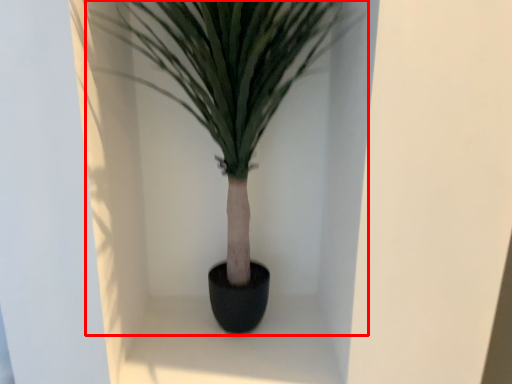
Question: From the image's perspective, where is houseplant (annotated by the red box) located relative to window sill?

Choices:
 (A) below
 (B) above

Answer: (B)